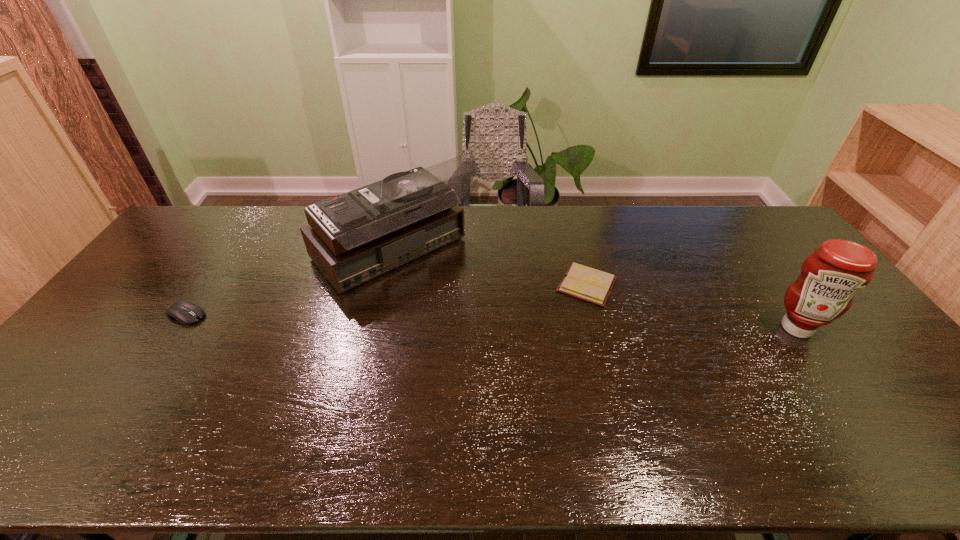
Find the location of `free space between the diary and the computer equipment`. free space between the diary and the computer equipment is located at coordinates (387, 300).

I want to click on free space between the leftmost object and the rightmost object, so click(x=492, y=321).

I want to click on vacant space that is in between the third object from left to right and the leftmost object, so click(x=387, y=300).

Find the location of a particular element. Image resolution: width=960 pixels, height=540 pixels. free point between the rightmost object and the leftmost object is located at coordinates (492, 321).

Where is `vacant area that lies between the second shortest object and the second object from left to right`? vacant area that lies between the second shortest object and the second object from left to right is located at coordinates (x=290, y=285).

Find the location of `free spot between the leftmost object and the tallest object`. free spot between the leftmost object and the tallest object is located at coordinates (290, 285).

Where is `free spot between the third shortest object and the leftmost object`? The height and width of the screenshot is (540, 960). free spot between the third shortest object and the leftmost object is located at coordinates (492, 321).

Find the location of `unoccupied area between the diary and the tallest object`. unoccupied area between the diary and the tallest object is located at coordinates (491, 269).

The image size is (960, 540). I want to click on vacant area that lies between the third shortest object and the shortest object, so click(x=692, y=306).

At what (x,y) coordinates should I click in order to perform the action: click on object that is the third closest to the leftmost object. Please return your answer as a coordinate pair (x, y). The width and height of the screenshot is (960, 540). Looking at the image, I should click on (830, 277).